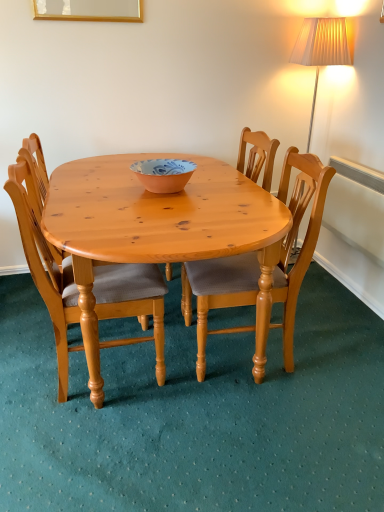
Question: Is light brown wooden chair at center, the first chair when ordered from left to right, surrounding wooden chair at center, positioned as the second chair in right-to-left order?

Choices:
 (A) yes
 (B) no

Answer: (B)

Question: Can you confirm if light brown wooden chair at center, the first chair when ordered from left to right, is thinner than wooden chair at center, positioned as the second chair in right-to-left order?

Choices:
 (A) no
 (B) yes

Answer: (A)

Question: Can you confirm if light brown wooden chair at center, the third chair when ordered from right to left, is taller than wooden chair at center, positioned as the second chair in right-to-left order?

Choices:
 (A) yes
 (B) no

Answer: (A)

Question: Is light brown wooden chair at center, the third chair when ordered from right to left, in front of wooden chair at center, positioned as the second chair in right-to-left order?

Choices:
 (A) yes
 (B) no

Answer: (A)

Question: Does light brown wooden chair at center, the first chair when ordered from left to right, appear on the right side of wooden chair at center, arranged as the 2th chair when viewed from the left?

Choices:
 (A) yes
 (B) no

Answer: (B)

Question: Based on their sizes in the image, would you say wooden chair at center, arranged as the 2th chair when viewed from the left, is bigger or smaller than light brown wood chair at center, the 3th chair in the left-to-right sequence?

Choices:
 (A) small
 (B) big

Answer: (B)

Question: Is wooden chair at center, positioned as the second chair in right-to-left order, in front of or behind light brown wood chair at center, acting as the 1th chair starting from the right, in the image?

Choices:
 (A) behind
 (B) front

Answer: (A)

Question: Considering the relative positions of wooden chair at center, arranged as the 2th chair when viewed from the left, and light brown wood chair at center, the 3th chair in the left-to-right sequence, in the image provided, is wooden chair at center, arranged as the 2th chair when viewed from the left, to the left or to the right of light brown wood chair at center, the 3th chair in the left-to-right sequence,?

Choices:
 (A) left
 (B) right

Answer: (A)

Question: Considering the positions of point (246, 133) and point (200, 302), is point (246, 133) closer or farther from the camera than point (200, 302)?

Choices:
 (A) closer
 (B) farther

Answer: (B)

Question: From the image's perspective, is blue and white ceramic bowl at center above or below light brown wood chair at center, the 3th chair in the left-to-right sequence?

Choices:
 (A) above
 (B) below

Answer: (A)

Question: Considering the positions of blue and white ceramic bowl at center and light brown wood chair at center, the 3th chair in the left-to-right sequence, in the image, is blue and white ceramic bowl at center taller or shorter than light brown wood chair at center, the 3th chair in the left-to-right sequence,?

Choices:
 (A) tall
 (B) short

Answer: (B)

Question: Is blue and white ceramic bowl at center inside or outside of light brown wood chair at center, acting as the 1th chair starting from the right?

Choices:
 (A) inside
 (B) outside

Answer: (B)

Question: From a real-world perspective, is blue and white ceramic bowl at center physically located above or below light brown wood chair at center, the 3th chair in the left-to-right sequence?

Choices:
 (A) above
 (B) below

Answer: (A)

Question: Is light brown wooden chair at center, the first chair when ordered from left to right, situated inside light brown wood chair at center, the 3th chair in the left-to-right sequence, or outside?

Choices:
 (A) inside
 (B) outside

Answer: (B)

Question: Considering the positions of point (127, 295) and point (302, 247), is point (127, 295) closer or farther from the camera than point (302, 247)?

Choices:
 (A) farther
 (B) closer

Answer: (B)